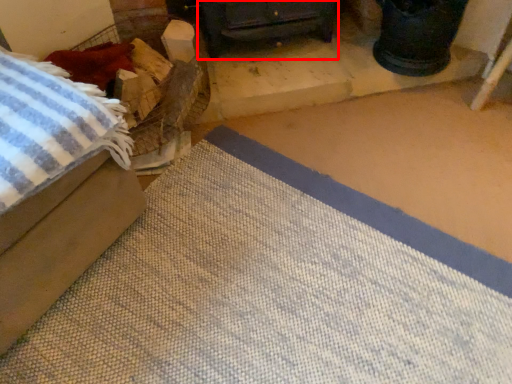
Question: In this image, where is furniture (annotated by the red box) located relative to furniture?

Choices:
 (A) left
 (B) right

Answer: (B)